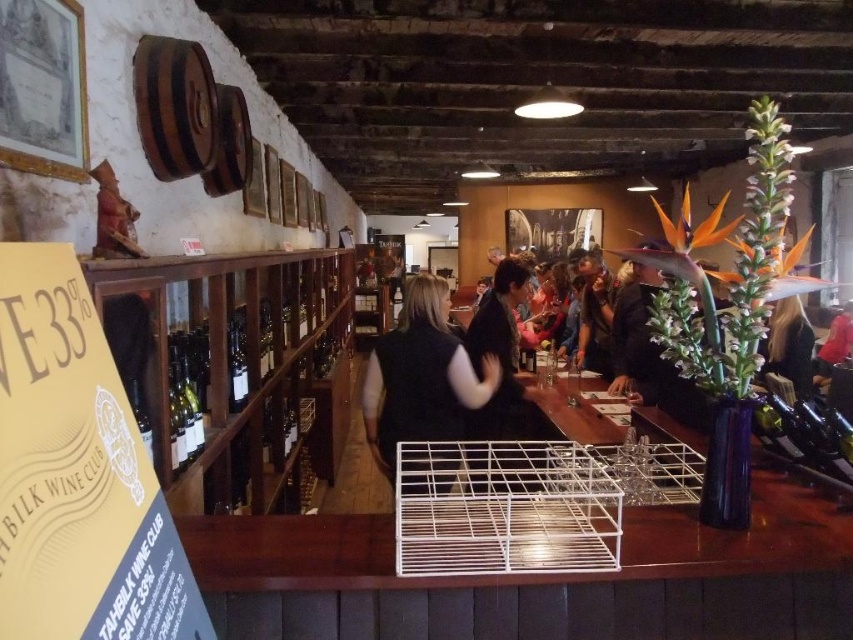
You are a customer in the wine cellar and want to place your matte black jacket at center on the counter without covering the shiny gold wine bottle at center. Given their sizes, can you do this?

The matte black jacket at center is wider than the shiny gold wine bottle at center, so it can be placed on the counter without covering the bottle as long as there is enough space alongside it.

You are standing at the entrance of the wine cellar and see two points marked in the image. Which point is closer to you, point [453,460] or point [477,360]?

Point [453,460] is in front of point [477,360], so it is closer to you.

You are a customer in the wine cellar and want to place your matte black jacket at center on top of the shiny gold wine bottle at center. Is this possible based on their sizes?

The matte black jacket at center is taller than the shiny gold wine bottle at center, so placing the jacket on top of the bottle may not be stable due to the jacket being taller. It might fall off or not fit properly.